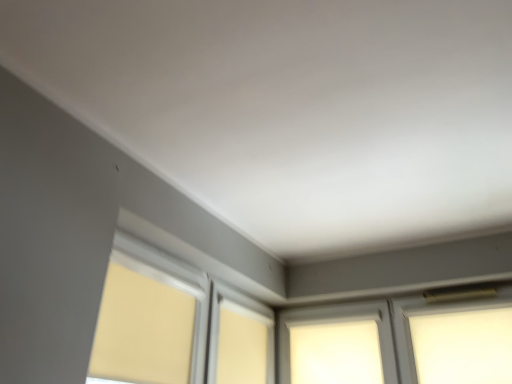
Question: In terms of height, does white frosted glass at center, acting as the first window starting from the left, look taller or shorter compared to white frosted glass at upper right, which appears as the 1th window when viewed from the right?

Choices:
 (A) short
 (B) tall

Answer: (B)

Question: From a real-world perspective, is white frosted glass at center, the 2th window in the right-to-left sequence, above or below white frosted glass at upper right, placed as the second window when sorted from left to right?

Choices:
 (A) below
 (B) above

Answer: (B)

Question: Which is nearer to the white frosted glass at center, the 2th window in the right-to-left sequence?

Choices:
 (A) white frosted glass at upper right, which appears as the 1th window when viewed from the right
 (B) matte yellow roller shade at lower left

Answer: (A)

Question: Which object is positioned farthest from the matte yellow roller shade at lower left?

Choices:
 (A) white frosted glass at center, acting as the first window starting from the left
 (B) white frosted glass at upper right, placed as the second window when sorted from left to right

Answer: (B)